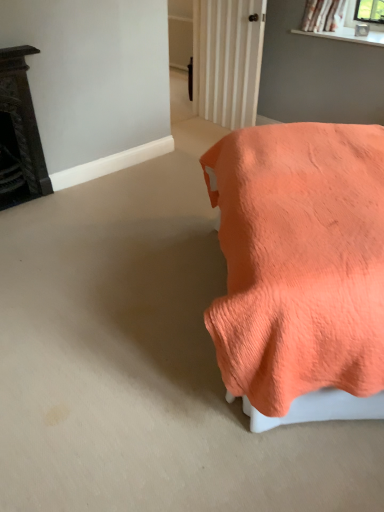
Question: From a real-world perspective, is coral fabric bed at right, which is the 2th furniture from left to right, on dark brown ornate fireplace at left, arranged as the 1th furniture when viewed from the left?

Choices:
 (A) no
 (B) yes

Answer: (B)

Question: Is coral fabric bed at right, which is the 2th furniture from left to right, shorter than dark brown ornate fireplace at left, arranged as the 1th furniture when viewed from the left?

Choices:
 (A) yes
 (B) no

Answer: (B)

Question: Is coral fabric bed at right, which is the 2th furniture from left to right, facing towards dark brown ornate fireplace at left, which is the second furniture from right to left?

Choices:
 (A) no
 (B) yes

Answer: (B)

Question: Can you confirm if coral fabric bed at right, which is the 2th furniture from left to right, is smaller than dark brown ornate fireplace at left, arranged as the 1th furniture when viewed from the left?

Choices:
 (A) no
 (B) yes

Answer: (A)

Question: From the image's perspective, is coral fabric bed at right, which is the 2th furniture from left to right, located beneath dark brown ornate fireplace at left, which is the second furniture from right to left?

Choices:
 (A) no
 (B) yes

Answer: (B)

Question: Is coral fabric bed at right, which is the 2th furniture from left to right, behind dark brown ornate fireplace at left, arranged as the 1th furniture when viewed from the left?

Choices:
 (A) no
 (B) yes

Answer: (A)

Question: From a real-world perspective, is dark brown ornate fireplace at left, arranged as the 1th furniture when viewed from the left, located beneath coral fabric bed at right, the 1th furniture from the right?

Choices:
 (A) yes
 (B) no

Answer: (A)

Question: Can you confirm if dark brown ornate fireplace at left, which is the second furniture from right to left, is smaller than coral fabric bed at right, which is the 2th furniture from left to right?

Choices:
 (A) yes
 (B) no

Answer: (A)

Question: Is dark brown ornate fireplace at left, arranged as the 1th furniture when viewed from the left, positioned far away from coral fabric bed at right, which is the 2th furniture from left to right?

Choices:
 (A) no
 (B) yes

Answer: (B)

Question: Considering the relative sizes of dark brown ornate fireplace at left, which is the second furniture from right to left, and coral fabric bed at right, the 1th furniture from the right, in the image provided, is dark brown ornate fireplace at left, which is the second furniture from right to left, taller than coral fabric bed at right, the 1th furniture from the right,?

Choices:
 (A) yes
 (B) no

Answer: (B)

Question: Is dark brown ornate fireplace at left, which is the second furniture from right to left, oriented towards coral fabric bed at right, which is the 2th furniture from left to right?

Choices:
 (A) yes
 (B) no

Answer: (A)

Question: Does dark brown ornate fireplace at left, which is the second furniture from right to left, lie in front of coral fabric bed at right, which is the 2th furniture from left to right?

Choices:
 (A) yes
 (B) no

Answer: (B)

Question: Considering the positions of coral fabric bed at right, the 1th furniture from the right, and dark brown ornate fireplace at left, arranged as the 1th furniture when viewed from the left, in the image, is coral fabric bed at right, the 1th furniture from the right, wider or thinner than dark brown ornate fireplace at left, arranged as the 1th furniture when viewed from the left,?

Choices:
 (A) thin
 (B) wide

Answer: (B)